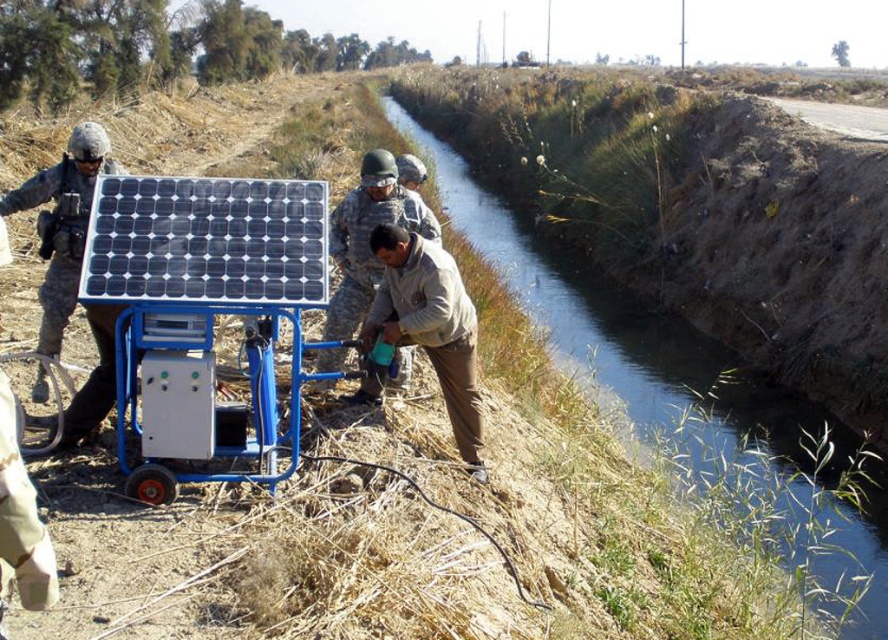
Can you confirm if green grassy bank at center is positioned above brown cotton shirt at center?

Yes, green grassy bank at center is above brown cotton shirt at center.

Who is more distant from viewer, [825,540] or [460,413]?

The point [825,540] is behind.

Where is `green grassy bank at center`? This screenshot has height=640, width=888. green grassy bank at center is located at coordinates (680, 397).

Is point (377, 333) closer to camera compared to point (70, 150)?

No, (377, 333) is behind (70, 150).

Is brown cotton shirt at center smaller than matte black helmet at left?

No.

Where is `brown cotton shirt at center`? The width and height of the screenshot is (888, 640). brown cotton shirt at center is located at coordinates (429, 324).

Who is positioned more to the left, green grassy bank at center or matte black helmet at left?

matte black helmet at left

Describe the element at coordinates (680, 397) in the screenshot. Image resolution: width=888 pixels, height=640 pixels. I see `green grassy bank at center` at that location.

I want to click on green grassy bank at center, so click(680, 397).